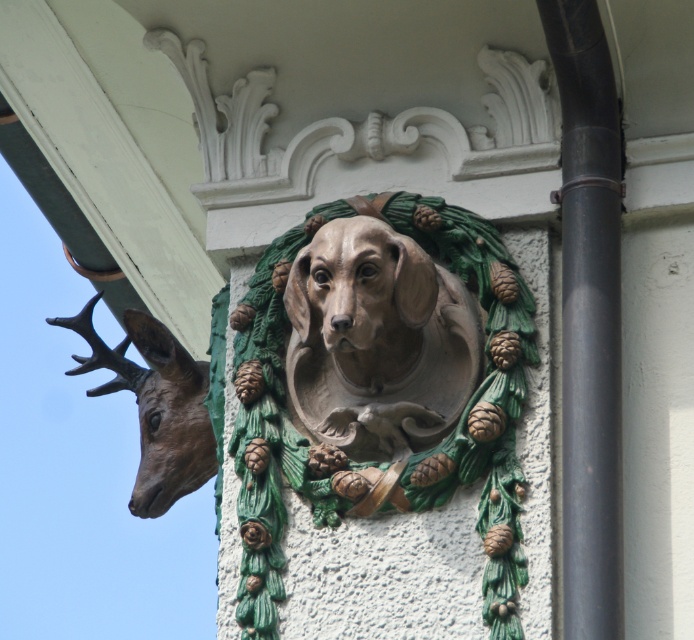
Question: Does black matte pipe at right appear on the left side of bronze textured deer head at left?

Choices:
 (A) no
 (B) yes

Answer: (A)

Question: Can you confirm if matte gray stone dog at center is bigger than black matte pipe at right?

Choices:
 (A) yes
 (B) no

Answer: (B)

Question: Which object is positioned closest to the black matte pipe at right?

Choices:
 (A) matte gray stone dog at center
 (B) bronze textured deer head at left

Answer: (A)

Question: Which is farther from the matte gray stone dog at center?

Choices:
 (A) bronze textured deer head at left
 (B) black matte pipe at right

Answer: (A)

Question: Can you confirm if matte gray stone dog at center is positioned below black matte pipe at right?

Choices:
 (A) yes
 (B) no

Answer: (B)

Question: Which object appears closest to the camera in this image?

Choices:
 (A) black matte pipe at right
 (B) matte gray stone dog at center

Answer: (A)